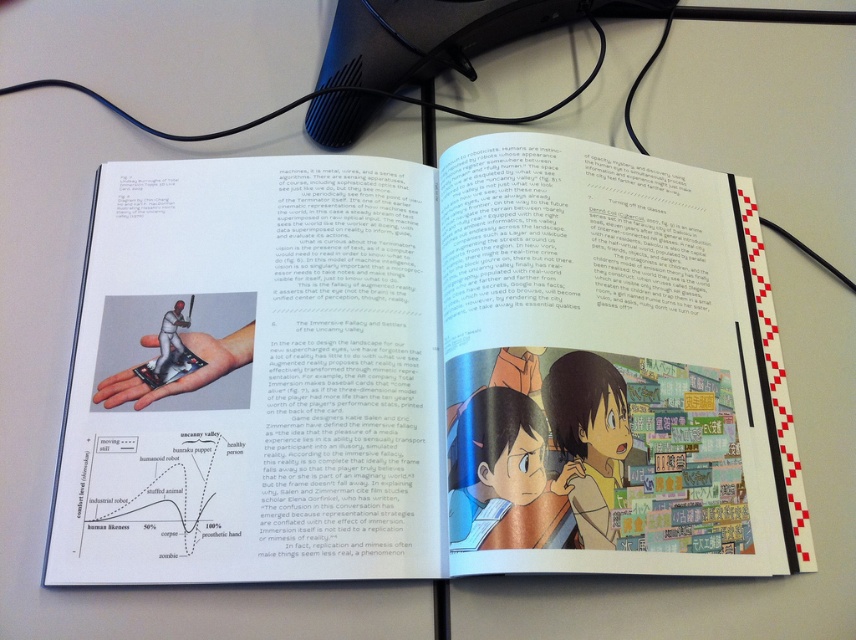
Question: Does matte paper book at center have a larger size compared to smooth skin hand at center?

Choices:
 (A) yes
 (B) no

Answer: (A)

Question: Among these objects, which one is farthest from the camera?

Choices:
 (A) smooth skin hand at center
 (B) matte paper book at center

Answer: (A)

Question: Is matte paper book at center further to the viewer compared to smooth skin hand at center?

Choices:
 (A) yes
 (B) no

Answer: (B)

Question: Which point appears closest to the camera in this image?

Choices:
 (A) (685, 268)
 (B) (250, 328)

Answer: (B)

Question: Is the position of matte paper book at center more distant than that of smooth skin hand at center?

Choices:
 (A) yes
 (B) no

Answer: (B)

Question: Which object is farther from the camera taking this photo?

Choices:
 (A) matte paper book at center
 (B) smooth skin hand at center

Answer: (B)